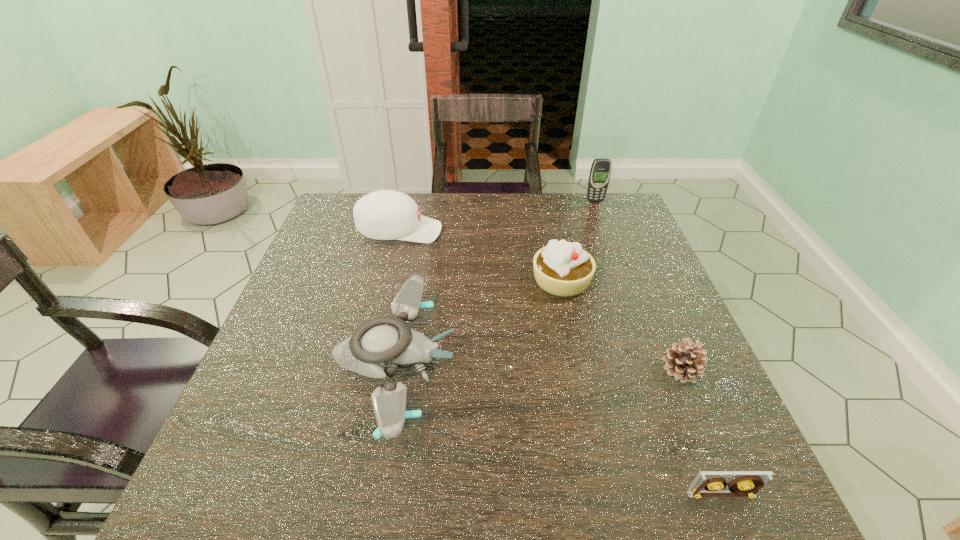
Where is `free space that is in between the third object from left to right and the farthest object`? free space that is in between the third object from left to right and the farthest object is located at coordinates (578, 241).

Identify the location of free spot between the second farthest object and the whipped cream. The image size is (960, 540). (481, 256).

Find the location of `free spot between the baseball cap and the whipped cream`. free spot between the baseball cap and the whipped cream is located at coordinates (481, 256).

Identify the location of unoccupied position between the baseball cap and the nearest object. The width and height of the screenshot is (960, 540). (561, 363).

Where is `free spot between the whipped cream and the nearest object`? This screenshot has width=960, height=540. free spot between the whipped cream and the nearest object is located at coordinates (x=641, y=388).

Locate an element on the screen. The height and width of the screenshot is (540, 960). empty space that is in between the whipped cream and the shortest object is located at coordinates (641, 388).

At what (x,y) coordinates should I click in order to perform the action: click on free area in between the fifth nearest object and the pinecone. Please return your answer as a coordinate pair (x, y). Image resolution: width=960 pixels, height=540 pixels. Looking at the image, I should click on (540, 301).

At what (x,y) coordinates should I click in order to perform the action: click on object that stands as the fifth closest to the cellular telephone. Please return your answer as a coordinate pair (x, y). Image resolution: width=960 pixels, height=540 pixels. Looking at the image, I should click on (745, 483).

The width and height of the screenshot is (960, 540). Identify the location of object that is the fifth closest to the pinecone. [x=600, y=171].

You are a GUI agent. You are given a task and a screenshot of the screen. Output one action in this format:
    pyautogui.click(x=<x>, y=<y>)
    Task: Click on the vacant space that satisfies the following two spatial constraints: 1. on the front-facing side of the baseball cap; 2. on the right side of the pinecone
    The width and height of the screenshot is (960, 540).
    Given the screenshot: What is the action you would take?
    pyautogui.click(x=367, y=371)